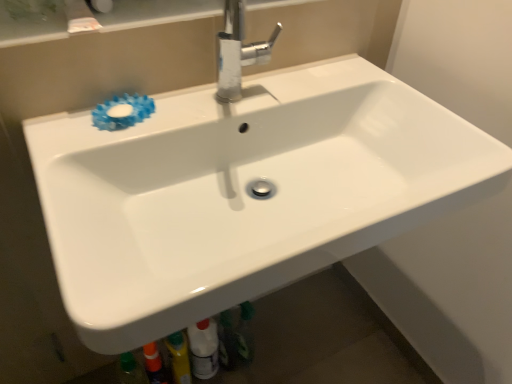
Where is `polished chrome faucet at upper center`? polished chrome faucet at upper center is located at coordinates (238, 51).

Is white glossy bottle at lower center to the left or to the right of polished chrome faucet at upper center in the image?

white glossy bottle at lower center is positioned on polished chrome faucet at upper center's left side.

Are white glossy bottle at lower center and polished chrome faucet at upper center making contact?

No.

Is white glossy bottle at lower center smaller than polished chrome faucet at upper center?

Correct, white glossy bottle at lower center occupies less space than polished chrome faucet at upper center.

The width and height of the screenshot is (512, 384). In the image, there is a white glossy bottle at lower center. Find the location of `tap above it (from the image's perspective)`. tap above it (from the image's perspective) is located at coordinates (238, 51).

Is white glossy bottle at lower center situated inside blue rubber flower at upper left or outside?

white glossy bottle at lower center is not enclosed by blue rubber flower at upper left.

From a real-world perspective, which object stands above the other?

blue rubber flower at upper left, from a real-world perspective.

I want to click on toiletry below the blue rubber flower at upper left (from a real-world perspective), so click(x=204, y=348).

Considering the points (137, 95) and (243, 39), which point is in front, point (137, 95) or point (243, 39)?

The point (243, 39) is closer.

Does blue rubber flower at upper left have a larger size compared to polished chrome faucet at upper center?

No, blue rubber flower at upper left is not bigger than polished chrome faucet at upper center.

Is polished chrome faucet at upper center surrounded by blue rubber flower at upper left?

No, polished chrome faucet at upper center is not inside blue rubber flower at upper left.

From the image's perspective, between polished chrome faucet at upper center and white glossy bottle at lower center, which one is located above?

polished chrome faucet at upper center.

Is polished chrome faucet at upper center positioned with its back to white glossy bottle at lower center?

No, polished chrome faucet at upper center is not facing the opposite direction of white glossy bottle at lower center.

Between polished chrome faucet at upper center and white glossy bottle at lower center, which one appears on the right side from the viewer's perspective?

polished chrome faucet at upper center is more to the right.

From the image's perspective, relative to white glossy bottle at lower center, is blue rubber flower at upper left above or below?

Based on their image positions, blue rubber flower at upper left is located above white glossy bottle at lower center.

Looking at this image, can you confirm if blue rubber flower at upper left is positioned to the left of white glossy bottle at lower center?

Indeed, blue rubber flower at upper left is positioned on the left side of white glossy bottle at lower center.

Would you consider blue rubber flower at upper left to be distant from white glossy bottle at lower center?

No.

Is point (244, 20) closer or farther from the camera than point (148, 101)?

Point (244, 20).

From the image's perspective, is polished chrome faucet at upper center on top of blue rubber flower at upper left?

Correct, polished chrome faucet at upper center appears higher than blue rubber flower at upper left in the image.

Would you say blue rubber flower at upper left is part of polished chrome faucet at upper center's contents?

That's incorrect, blue rubber flower at upper left is not inside polished chrome faucet at upper center.

This screenshot has width=512, height=384. Find the location of `toiletry behind the polished chrome faucet at upper center`. toiletry behind the polished chrome faucet at upper center is located at coordinates (204, 348).

Where is `toiletry to the right of blue rubber flower at upper left`? This screenshot has width=512, height=384. toiletry to the right of blue rubber flower at upper left is located at coordinates (204, 348).

Which object lies nearer to the anchor point polished chrome faucet at upper center, blue rubber flower at upper left or white glossy bottle at lower center?

blue rubber flower at upper left.

Based on their spatial positions, is white glossy bottle at lower center or polished chrome faucet at upper center further from blue rubber flower at upper left?

white glossy bottle at lower center is positioned further to the anchor blue rubber flower at upper left.

From the picture: Considering their positions, is polished chrome faucet at upper center positioned closer to white glossy bottle at lower center than blue rubber flower at upper left?

blue rubber flower at upper left lies closer to white glossy bottle at lower center than the other object.

Considering their positions, is white glossy bottle at lower center positioned further to polished chrome faucet at upper center than blue rubber flower at upper left?

white glossy bottle at lower center is further to polished chrome faucet at upper center.

Which object lies nearer to the anchor point white glossy bottle at lower center, blue rubber flower at upper left or polished chrome faucet at upper center?

blue rubber flower at upper left is closer to white glossy bottle at lower center.

Consider the image. When comparing their distances from blue rubber flower at upper left, does polished chrome faucet at upper center or white glossy bottle at lower center seem closer?

polished chrome faucet at upper center lies closer to blue rubber flower at upper left than the other object.

Where is `flower between polished chrome faucet at upper center and white glossy bottle at lower center from top to bottom`? The image size is (512, 384). flower between polished chrome faucet at upper center and white glossy bottle at lower center from top to bottom is located at coordinates (122, 112).